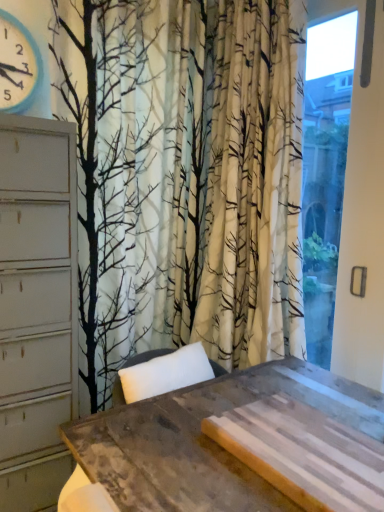
Question: From the image's perspective, is blue plastic clock at upper left located beneath rustic wood table at center?

Choices:
 (A) yes
 (B) no

Answer: (B)

Question: Is rustic wood table at center located within blue plastic clock at upper left?

Choices:
 (A) no
 (B) yes

Answer: (A)

Question: Is blue plastic clock at upper left wider than rustic wood table at center?

Choices:
 (A) yes
 (B) no

Answer: (B)

Question: Would you consider blue plastic clock at upper left to be distant from rustic wood table at center?

Choices:
 (A) yes
 (B) no

Answer: (A)

Question: Is blue plastic clock at upper left taller than rustic wood table at center?

Choices:
 (A) yes
 (B) no

Answer: (B)

Question: Is transparent glass window at right in front of or behind rustic wood table at center in the image?

Choices:
 (A) behind
 (B) front

Answer: (A)

Question: In terms of size, does transparent glass window at right appear bigger or smaller than rustic wood table at center?

Choices:
 (A) big
 (B) small

Answer: (B)

Question: Is transparent glass window at right to the left or to the right of rustic wood table at center in the image?

Choices:
 (A) right
 (B) left

Answer: (A)

Question: Looking at their shapes, would you say transparent glass window at right is wider or thinner than rustic wood table at center?

Choices:
 (A) thin
 (B) wide

Answer: (A)

Question: Considering the positions of blue plastic clock at upper left and rustic wood table at center in the image, is blue plastic clock at upper left taller or shorter than rustic wood table at center?

Choices:
 (A) tall
 (B) short

Answer: (B)

Question: Relative to rustic wood table at center, is blue plastic clock at upper left in front or behind?

Choices:
 (A) behind
 (B) front

Answer: (A)

Question: From a real-world perspective, is blue plastic clock at upper left above or below rustic wood table at center?

Choices:
 (A) below
 (B) above

Answer: (B)

Question: Considering the positions of blue plastic clock at upper left and rustic wood table at center in the image, is blue plastic clock at upper left wider or thinner than rustic wood table at center?

Choices:
 (A) wide
 (B) thin

Answer: (B)

Question: In terms of width, does blue plastic clock at upper left look wider or thinner when compared to transparent glass window at right?

Choices:
 (A) wide
 (B) thin

Answer: (A)

Question: From a real-world perspective, is blue plastic clock at upper left above or below transparent glass window at right?

Choices:
 (A) above
 (B) below

Answer: (A)